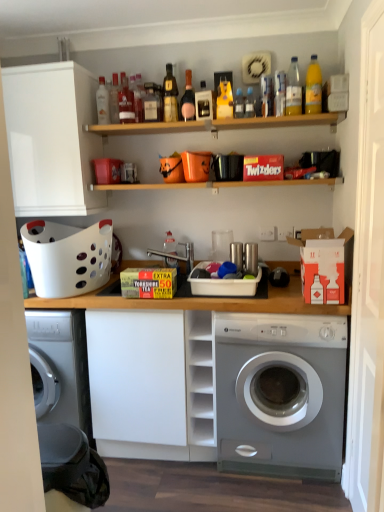
Question: Should I look upward or downward to see matte white bottle at center, arranged as the seventh bottle when viewed from the right?

Choices:
 (A) up
 (B) down

Answer: (A)

Question: From the image's perspective, is yellow plastic bottle at upper center, which is the fourth bottle from right to left, above white matte cabinet at upper left?

Choices:
 (A) yes
 (B) no

Answer: (A)

Question: Is yellow plastic bottle at upper center, which is the fourth bottle from right to left, aimed at white matte cabinet at upper left?

Choices:
 (A) yes
 (B) no

Answer: (B)

Question: Does yellow plastic bottle at upper center, acting as the 7th bottle starting from the left, have a lesser height compared to white matte cabinet at upper left?

Choices:
 (A) no
 (B) yes

Answer: (B)

Question: From a real-world perspective, is yellow plastic bottle at upper center, which is the fourth bottle from right to left, physically below white matte cabinet at upper left?

Choices:
 (A) no
 (B) yes

Answer: (A)

Question: Can we say yellow plastic bottle at upper center, which is the fourth bottle from right to left, lies outside white matte cabinet at upper left?

Choices:
 (A) yes
 (B) no

Answer: (A)

Question: From the image's perspective, is yellow plastic bottle at upper center, acting as the 7th bottle starting from the left, under white matte cabinet at upper left?

Choices:
 (A) no
 (B) yes

Answer: (A)

Question: Could you tell me if wooden shelf at upper center is facing yellow plastic bottle at upper center, acting as the 7th bottle starting from the left?

Choices:
 (A) no
 (B) yes

Answer: (A)

Question: Are wooden shelf at upper center and yellow plastic bottle at upper center, which is the fourth bottle from right to left, located far from each other?

Choices:
 (A) yes
 (B) no

Answer: (B)

Question: From the image's perspective, is wooden shelf at upper center below yellow plastic bottle at upper center, which is the fourth bottle from right to left?

Choices:
 (A) no
 (B) yes

Answer: (B)

Question: Is wooden shelf at upper center not inside yellow plastic bottle at upper center, acting as the 7th bottle starting from the left?

Choices:
 (A) no
 (B) yes

Answer: (B)

Question: Is wooden shelf at upper center shorter than yellow plastic bottle at upper center, which is the fourth bottle from right to left?

Choices:
 (A) yes
 (B) no

Answer: (A)

Question: Can you confirm if wooden shelf at upper center is positioned to the right of yellow plastic bottle at upper center, which is the fourth bottle from right to left?

Choices:
 (A) no
 (B) yes

Answer: (A)

Question: Is translucent glass bottle at upper center, acting as the fifth bottle starting from the left, completely or partially inside translucent plastic bottle at upper center, the 3th bottle viewed from the right?

Choices:
 (A) yes
 (B) no

Answer: (B)